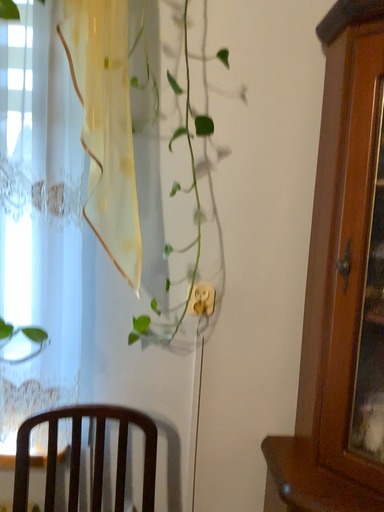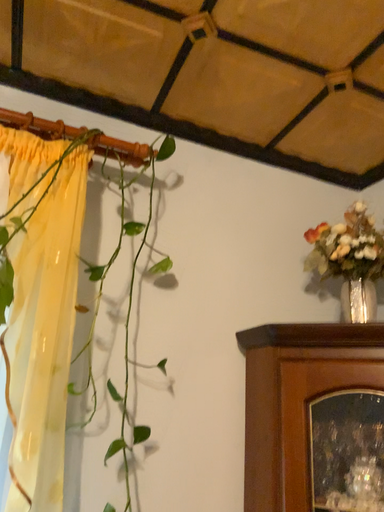
Question: Which way did the camera rotate in the video?

Choices:
 (A) rotated upward
 (B) rotated downward

Answer: (A)